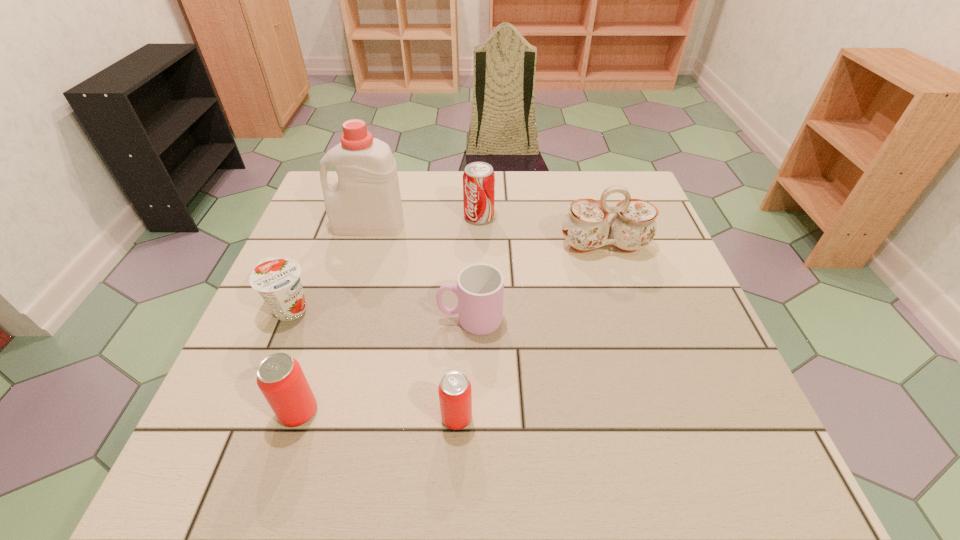
Given the evenly spaced beer cans in the image, where should an extra beer can be added on the right to preserve the spacing? Please point to a vacant space. Please provide its 2D coordinates. Your answer should be formatted as a tuple, i.e. [(x, y)], where the tuple contains the x and y coordinates of a point satisfying the conditions above.

[(618, 423)]